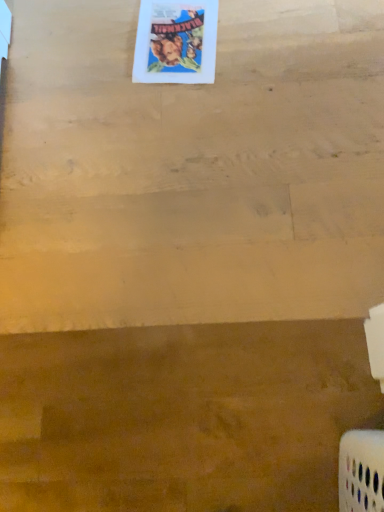
This screenshot has width=384, height=512. In order to click on free spot in front of matte paper comic book at upper center in this screenshot , I will do `click(200, 113)`.